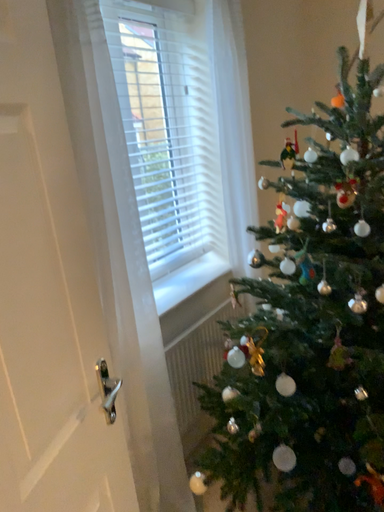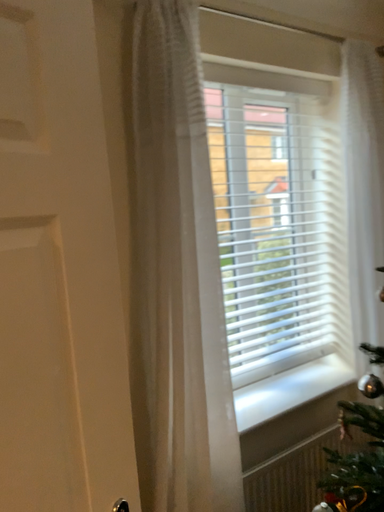
Question: Which way did the camera rotate in the video?

Choices:
 (A) rotated upward
 (B) rotated downward

Answer: (A)